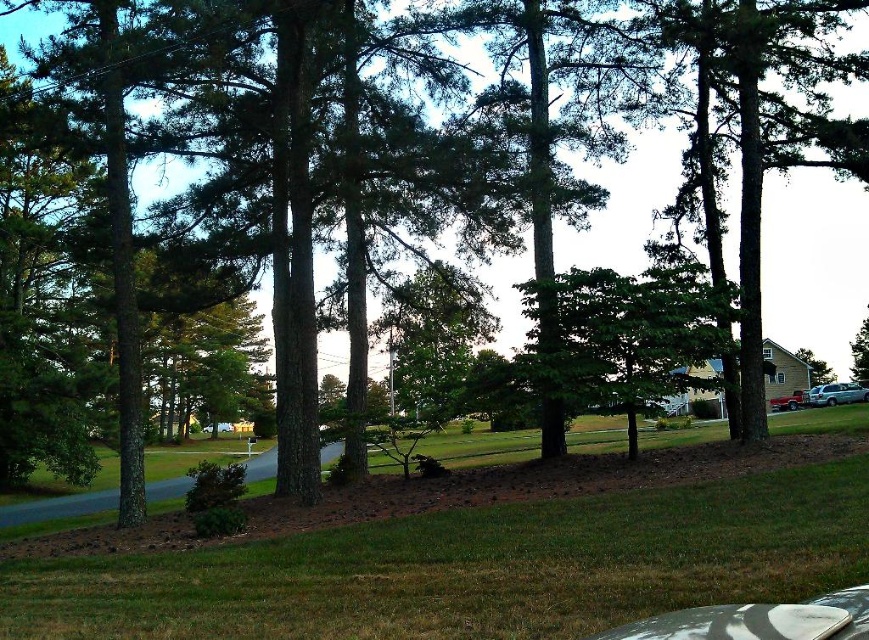
Question: Which object is positioned farthest from the green leafy tree at center?

Choices:
 (A) green grass at lower center
 (B) satin silver suv at lower right

Answer: (B)

Question: Is the position of green leafy tree at center less distant than that of satin silver suv at lower right?

Choices:
 (A) yes
 (B) no

Answer: (A)

Question: Which object appears closest to the camera in this image?

Choices:
 (A) satin silver suv at lower right
 (B) green grass at lower center

Answer: (B)

Question: Which point appears farthest from the camera in this image?

Choices:
 (A) (564, 298)
 (B) (857, 400)
 (C) (684, 500)

Answer: (B)

Question: Is green leafy tree at center further to camera compared to satin silver suv at lower right?

Choices:
 (A) no
 (B) yes

Answer: (A)

Question: Is green matte tree at center below green leafy tree at right?

Choices:
 (A) no
 (B) yes

Answer: (A)